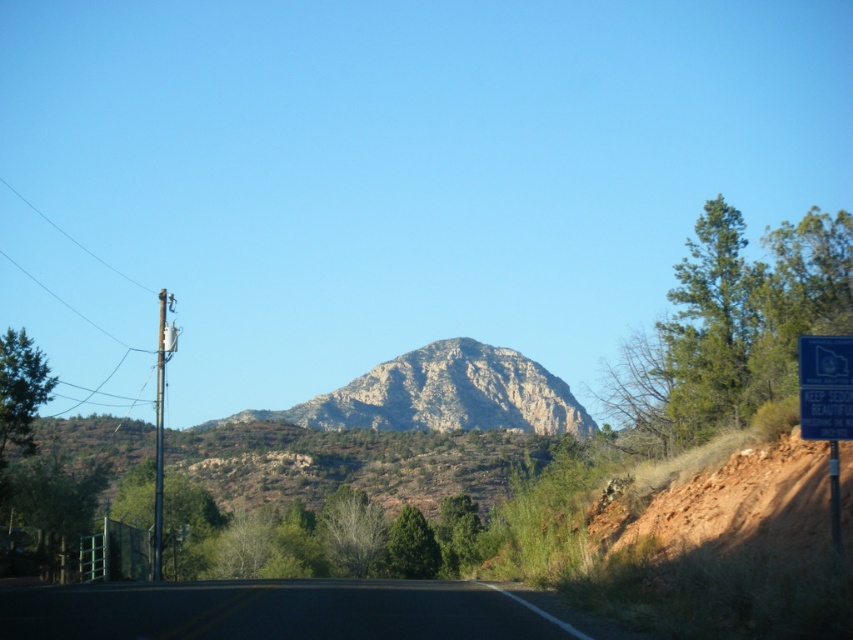
You are a hiker planning to walk from the black asphalt road at center to the rugged stone mountain at center. Based on the scene, can you estimate how far you need to walk to reach the mountain from the road?

The distance between the black asphalt road at center and the rugged stone mountain at center is 120.84 meters, so you need to walk approximately 120.84 meters to reach the mountain from the road.

You are a hiker standing at the base of the mountain looking up the trail. You see the black asphalt road at center and the blue plastic sign at right. Which object is higher in elevation?

The black asphalt road at center is taller than the blue plastic sign at right, so the black asphalt road at center is higher in elevation.

You are a hiker planning to climb the rugged stone mountain at center. You notice the black asphalt road at center nearby. Which object is taller when viewed from the base of the mountain?

The rugged stone mountain at center is taller than the black asphalt road at center.